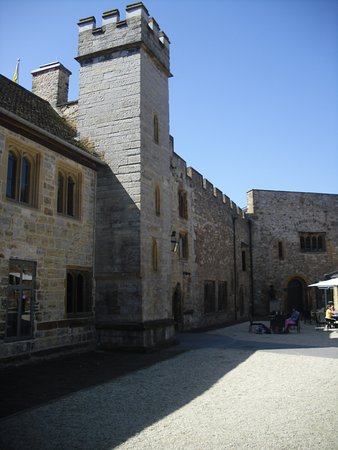
Find the location of a particular element. three sets of identical recessed windows in wall on left side of image is located at coordinates (21, 173), (67, 189), (80, 288).